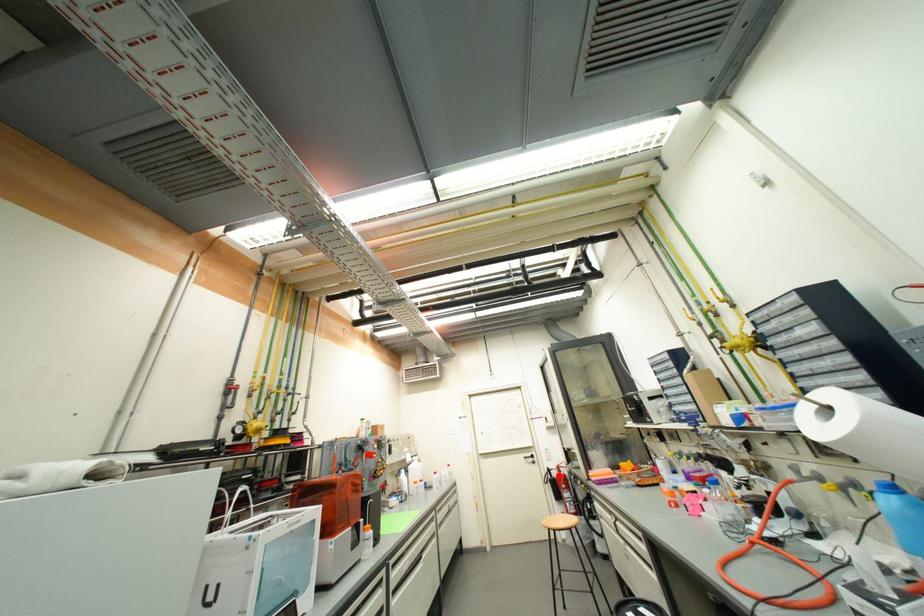
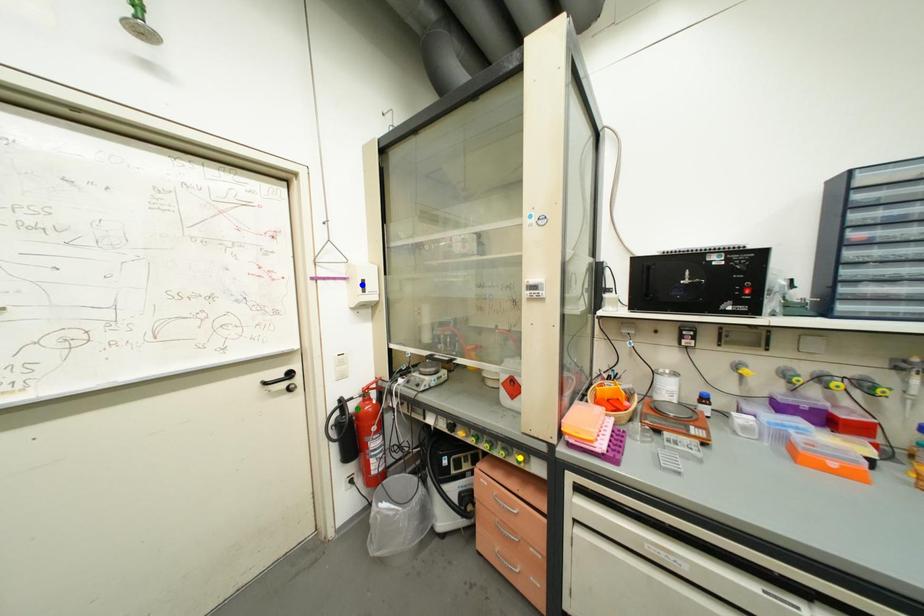
Question: I am providing you with two images of the same scene from different viewpoints. A red point is marked on the first image. You are given multiple points on the second image. Which spot in image 2 lines up with the point in image 1?

Choices:
 (A) blue point
 (B) green point
 (C) yellow point

Answer: (B)